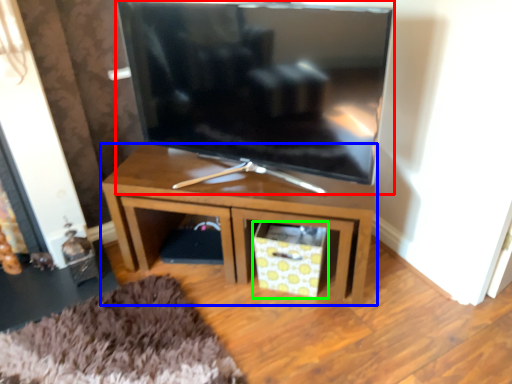
Question: Based on their relative distances, which object is nearer to television (highlighted by a red box)? Choose from table (highlighted by a blue box) and drawer (highlighted by a green box).

Choices:
 (A) table
 (B) drawer

Answer: (A)